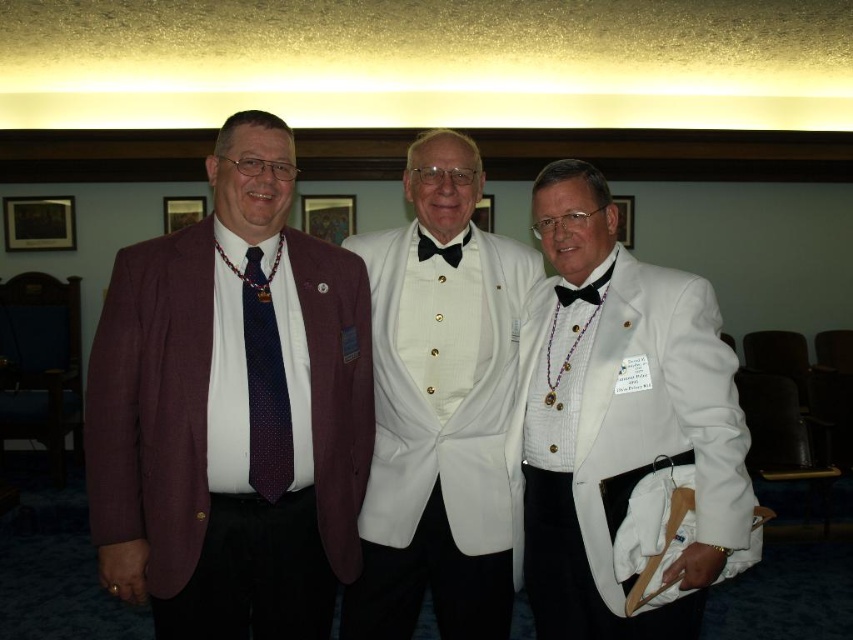
Question: Considering the real-world distances, which object is closest to the white satin tuxedo at center?

Choices:
 (A) dark blue dotted tie at center
 (B) black satin bow tie at center
 (C) white satin bow tie at center

Answer: (C)

Question: Does white satin tuxedo at center have a lesser width compared to dark blue dotted tie at center?

Choices:
 (A) no
 (B) yes

Answer: (A)

Question: Can you confirm if matte maroon blazer at left is thinner than dark blue dotted tie at center?

Choices:
 (A) no
 (B) yes

Answer: (A)

Question: Is the position of white satin bow tie at center less distant than that of black satin bow tie at center?

Choices:
 (A) no
 (B) yes

Answer: (B)

Question: Among these objects, which one is farthest from the camera?

Choices:
 (A) black satin bow tie at center
 (B) dark blue dotted tie at center
 (C) white satin bow tie at center

Answer: (A)

Question: Which of these objects is positioned closest to the white satin tuxedo at center?

Choices:
 (A) white satin bow tie at center
 (B) matte maroon blazer at left
 (C) dark blue dotted tie at center
 (D) black satin bow tie at center

Answer: (A)